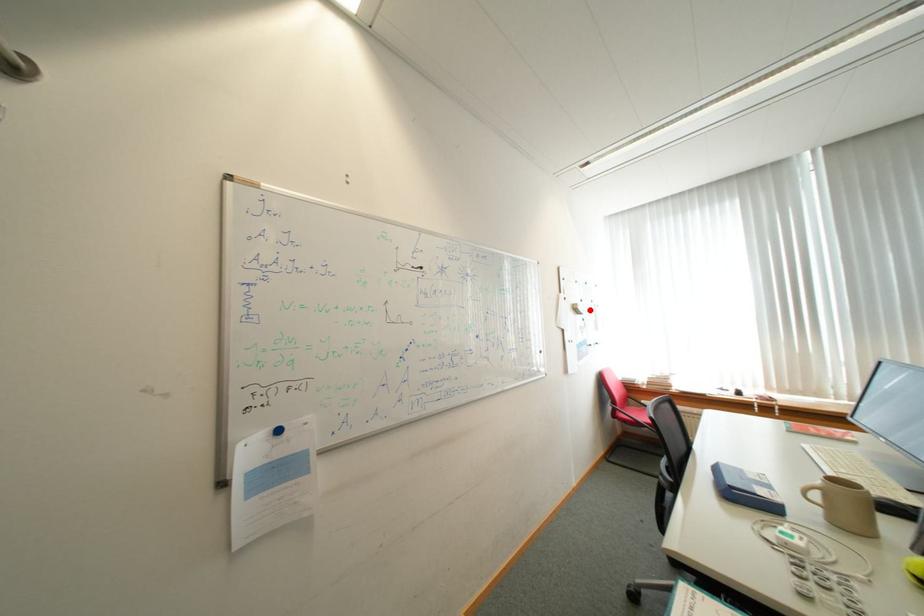
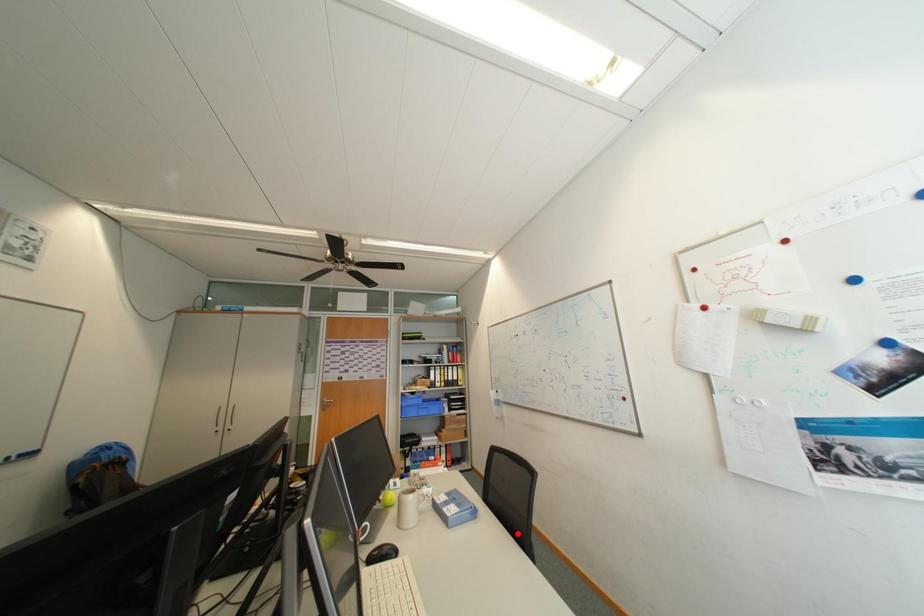
I am providing you with two images of the same scene from different viewpoints. A red point is marked on the first image and another point is marked on the second image. Are the points marked in image1 and image2 representing the same 3D position?

No